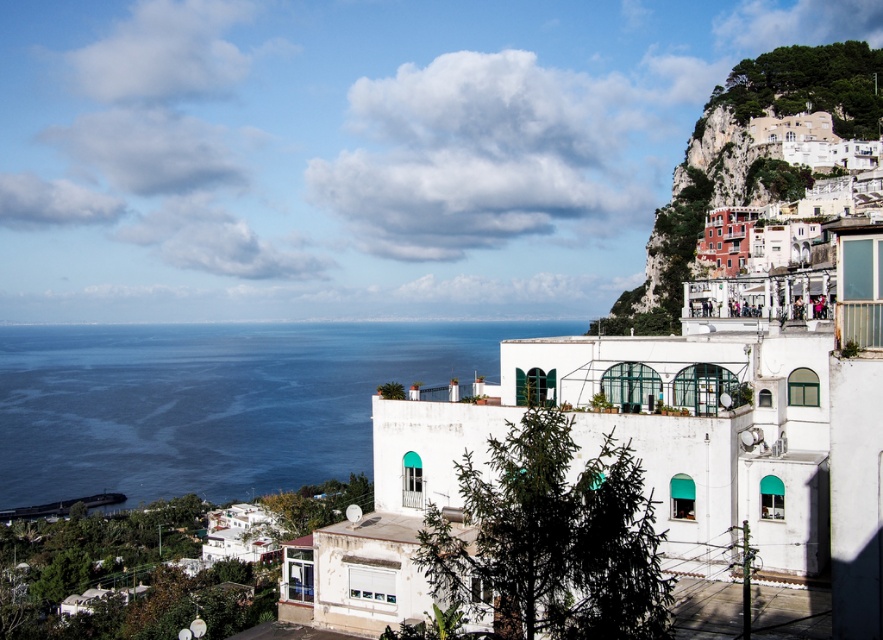
Question: Can you confirm if blue water at left is positioned to the right of white stucco houses at upper right?

Choices:
 (A) no
 (B) yes

Answer: (A)

Question: Observing the image, what is the correct spatial positioning of blue water at left in reference to white stucco houses at upper right?

Choices:
 (A) above
 (B) below

Answer: (B)

Question: Can you confirm if blue water at left is smaller than white stucco houses at upper right?

Choices:
 (A) yes
 (B) no

Answer: (B)

Question: Among these points, which one is nearest to the camera?

Choices:
 (A) (177, 422)
 (B) (776, 193)

Answer: (B)

Question: Which point is farther to the camera?

Choices:
 (A) (141, 449)
 (B) (765, 176)

Answer: (A)